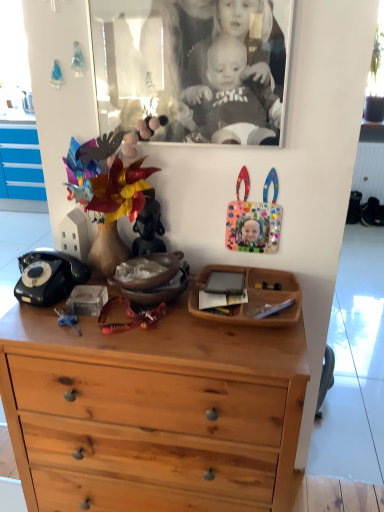
Question: Is the position of black glass picture frame at upper center more distant than that of matte ceramic vase at center, placed as the first toy when sorted from left to right?

Choices:
 (A) yes
 (B) no

Answer: (B)

Question: Does black glass picture frame at upper center have a greater width compared to matte ceramic vase at center, placed as the first toy when sorted from left to right?

Choices:
 (A) no
 (B) yes

Answer: (A)

Question: Is black glass picture frame at upper center located outside matte ceramic vase at center, placed as the first toy when sorted from left to right?

Choices:
 (A) no
 (B) yes

Answer: (B)

Question: Is the depth of black glass picture frame at upper center less than that of matte ceramic vase at center, placed as the first toy when sorted from left to right?

Choices:
 (A) no
 (B) yes

Answer: (B)

Question: Are black glass picture frame at upper center and matte ceramic vase at center, which is the 2th toy from right to left, making contact?

Choices:
 (A) no
 (B) yes

Answer: (A)

Question: Can matte ceramic vase at center, placed as the first toy when sorted from left to right, be found inside black glass picture frame at upper center?

Choices:
 (A) yes
 (B) no

Answer: (B)

Question: Considering the relative sizes of colorful plastic frame at upper right, positioned as the 2th toy in left-to-right order, and light brown wood chest of drawers at center in the image provided, is colorful plastic frame at upper right, positioned as the 2th toy in left-to-right order, shorter than light brown wood chest of drawers at center?

Choices:
 (A) yes
 (B) no

Answer: (A)

Question: Is colorful plastic frame at upper right, positioned as the 2th toy in left-to-right order, further to the viewer compared to light brown wood chest of drawers at center?

Choices:
 (A) yes
 (B) no

Answer: (A)

Question: Is colorful plastic frame at upper right, positioned as the 2th toy in left-to-right order, outside of light brown wood chest of drawers at center?

Choices:
 (A) no
 (B) yes

Answer: (B)

Question: Is colorful plastic frame at upper right, the 1th toy in the right-to-left sequence, in front of light brown wood chest of drawers at center?

Choices:
 (A) yes
 (B) no

Answer: (B)

Question: From a real-world perspective, is colorful plastic frame at upper right, the 1th toy in the right-to-left sequence, on top of light brown wood chest of drawers at center?

Choices:
 (A) no
 (B) yes

Answer: (B)

Question: Does colorful plastic frame at upper right, the 1th toy in the right-to-left sequence, appear on the right side of light brown wood chest of drawers at center?

Choices:
 (A) no
 (B) yes

Answer: (B)

Question: Would you consider black glass picture frame at upper center to be distant from light brown wood chest of drawers at center?

Choices:
 (A) no
 (B) yes

Answer: (A)